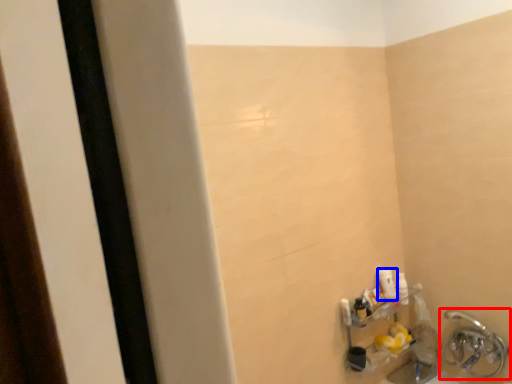
Question: Which of the following is the farthest to the observer, plumbing fixture (highlighted by a red box) or toiletry (highlighted by a blue box)?

Choices:
 (A) plumbing fixture
 (B) toiletry

Answer: (B)